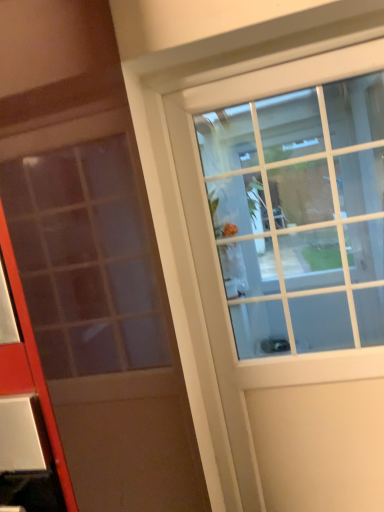
Question: Is white glass door at upper right, placed as the second door when sorted from front to back, taller or shorter than matte glass door at center, which is the 1th door in left-to-right order?

Choices:
 (A) short
 (B) tall

Answer: (B)

Question: Is white glass door at upper right, the 1th door when ordered from right to left, in front of or behind matte glass door at center, which is the first door in front-to-back order, in the image?

Choices:
 (A) behind
 (B) front

Answer: (A)

Question: Is white glass door at upper right, the 1th door when ordered from right to left, to the left or to the right of matte glass door at center, which is the second door from right to left, in the image?

Choices:
 (A) right
 (B) left

Answer: (A)

Question: From the image's perspective, is matte glass door at center, which is the 1th door in left-to-right order, positioned above or below white glass door at upper right, placed as the second door when sorted from front to back?

Choices:
 (A) below
 (B) above

Answer: (B)

Question: From a real-world perspective, is matte glass door at center, marked as the second door in a back-to-front arrangement, physically located above or below white glass door at upper right, the second door positioned from the left?

Choices:
 (A) below
 (B) above

Answer: (B)

Question: Considering the relative positions of matte glass door at center, which is the second door from right to left, and white glass door at upper right, the 1th door when ordered from back to front, in the image provided, is matte glass door at center, which is the second door from right to left, to the left or to the right of white glass door at upper right, the 1th door when ordered from back to front,?

Choices:
 (A) right
 (B) left

Answer: (B)

Question: Considering the positions of matte glass door at center, which is the 1th door in left-to-right order, and white glass door at upper right, the 1th door when ordered from back to front, in the image, is matte glass door at center, which is the 1th door in left-to-right order, taller or shorter than white glass door at upper right, the 1th door when ordered from back to front,?

Choices:
 (A) short
 (B) tall

Answer: (A)